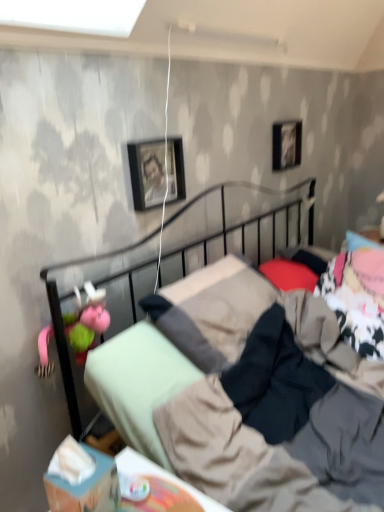
You are a GUI agent. You are given a task and a screenshot of the screen. Output one action in this format:
    pyautogui.click(x=<x>, y=<y>)
    Task: Click on the black glossy picture frame at upper right, the 1th picture frame from the top
    The height and width of the screenshot is (512, 384).
    Given the screenshot: What is the action you would take?
    pyautogui.click(x=286, y=145)

The image size is (384, 512). Describe the element at coordinates (86, 320) in the screenshot. I see `pink fabric doll at left` at that location.

Locate an element on the screen. This screenshot has width=384, height=512. blue cardboard box at lower left is located at coordinates (85, 487).

Describe the element at coordinates (289, 274) in the screenshot. This screenshot has height=512, width=384. I see `red matte pillow at center, marked as the first pillow in a front-to-back arrangement` at that location.

Image resolution: width=384 pixels, height=512 pixels. What are the coordinates of `black matte picture frame at upper center, acting as the 1th picture frame starting from the front` in the screenshot? It's located at (147, 173).

Find the location of a particular element. This screenshot has width=384, height=512. pillow that is the 2nd one when counting backward from the metallic black bed at center is located at coordinates (360, 242).

Which object is wider, pink fabric pillow at upper right, the 1th pillow when ordered from right to left, or metallic black bed at center?

metallic black bed at center is wider.

Is pink fabric pillow at upper right, which ranks as the second pillow in left-to-right order, looking in the opposite direction of metallic black bed at center?

Answer: No, pink fabric pillow at upper right, which ranks as the second pillow in left-to-right order,'s orientation is not away from metallic black bed at center.

Is pink fabric pillow at upper right, which is the first pillow in top-to-bottom order, situated inside metallic black bed at center or outside?

The correct answer is: outside.

Can you see black glossy picture frame at upper right, which is the 2th picture frame in bottom-to-top order, touching red matte pillow at center, the 2th pillow in the right-to-left sequence?

No.

Is black glossy picture frame at upper right, which appears as the first picture frame when viewed from the right, further to camera compared to red matte pillow at center, which is the second pillow in back-to-front order?

Yes, it is behind red matte pillow at center, which is the second pillow in back-to-front order.

From the image's perspective, is black glossy picture frame at upper right, which is the 2th picture frame in bottom-to-top order, above or below red matte pillow at center, acting as the 1th pillow starting from the left?

From the image's perspective, black glossy picture frame at upper right, which is the 2th picture frame in bottom-to-top order, appears above red matte pillow at center, acting as the 1th pillow starting from the left.

How many degrees apart are the facing directions of blue cardboard box at lower left and metallic black bed at center?

The facing directions of blue cardboard box at lower left and metallic black bed at center are 7.95 degrees apart.

Are blue cardboard box at lower left and metallic black bed at center located far from each other?

blue cardboard box at lower left is actually quite close to metallic black bed at center.

From a real-world perspective, which is physically above, blue cardboard box at lower left or metallic black bed at center?

In real-world perspective, blue cardboard box at lower left is above.

Who is shorter, blue cardboard box at lower left or metallic black bed at center?

blue cardboard box at lower left.

Is black glossy picture frame at upper right, placed as the first picture frame when sorted from back to front, located outside pink fabric pillow at upper right, the 1th pillow when ordered from right to left?

That's correct, black glossy picture frame at upper right, placed as the first picture frame when sorted from back to front, is outside of pink fabric pillow at upper right, the 1th pillow when ordered from right to left.

From a real-world perspective, between black glossy picture frame at upper right, placed as the first picture frame when sorted from back to front, and pink fabric pillow at upper right, the 1th pillow from the back, who is vertically higher?

From a 3D spatial view, black glossy picture frame at upper right, placed as the first picture frame when sorted from back to front, is above.

In terms of width, does black glossy picture frame at upper right, the 1th picture frame from the top, look wider or thinner when compared to pink fabric pillow at upper right, which appears as the 2th pillow when ordered from the bottom?

In the image, black glossy picture frame at upper right, the 1th picture frame from the top, appears to be more narrow than pink fabric pillow at upper right, which appears as the 2th pillow when ordered from the bottom.

Considering the relative sizes of black glossy picture frame at upper right, which is the 2th picture frame in bottom-to-top order, and pink fabric pillow at upper right, the 1th pillow from the back, in the image provided, is black glossy picture frame at upper right, which is the 2th picture frame in bottom-to-top order, shorter than pink fabric pillow at upper right, the 1th pillow from the back,?

Incorrect, the height of black glossy picture frame at upper right, which is the 2th picture frame in bottom-to-top order, does not fall short of that of pink fabric pillow at upper right, the 1th pillow from the back.

From the image's perspective, which is below, pink fabric doll at left or pink fabric pillow at upper right, the 1th pillow when ordered from right to left?

pink fabric doll at left appears lower in the image.

Considering the positions of points (78, 313) and (347, 236), is point (78, 313) closer to camera compared to point (347, 236)?

Yes, point (78, 313) is closer to viewer.

Does pink fabric doll at left contain pink fabric pillow at upper right, the 1th pillow from the back?

No, pink fabric pillow at upper right, the 1th pillow from the back, is not a part of pink fabric doll at left.

Considering the sizes of objects metallic black bed at center and black glossy picture frame at upper right, arranged as the second picture frame when viewed from the front, in the image provided, who is bigger, metallic black bed at center or black glossy picture frame at upper right, arranged as the second picture frame when viewed from the front,?

metallic black bed at center is bigger.

Is metallic black bed at center taller or shorter than black glossy picture frame at upper right, arranged as the second picture frame when viewed from the front?

metallic black bed at center is taller than black glossy picture frame at upper right, arranged as the second picture frame when viewed from the front.

Considering the positions of objects metallic black bed at center and black glossy picture frame at upper right, which appears as the first picture frame when viewed from the right, in the image provided, who is more to the left, metallic black bed at center or black glossy picture frame at upper right, which appears as the first picture frame when viewed from the right,?

metallic black bed at center.

From the image's perspective, which object appears higher, black matte picture frame at upper center, which is the second picture frame in right-to-left order, or metallic black bed at center?

black matte picture frame at upper center, which is the second picture frame in right-to-left order, is shown above in the image.

From a real-world perspective, relative to metallic black bed at center, is black matte picture frame at upper center, acting as the 1th picture frame starting from the front, vertically above or below?

In terms of real-world spatial position, black matte picture frame at upper center, acting as the 1th picture frame starting from the front, is above metallic black bed at center.

Is metallic black bed at center at the back of black matte picture frame at upper center, which is the second picture frame in right-to-left order?

No, black matte picture frame at upper center, which is the second picture frame in right-to-left order, is not facing the opposite direction of metallic black bed at center.

Image resolution: width=384 pixels, height=512 pixels. Find the location of `bed lying below the pink fabric pillow at upper right, the 1th pillow when ordered from right to left (from the image's perspective)`. bed lying below the pink fabric pillow at upper right, the 1th pillow when ordered from right to left (from the image's perspective) is located at coordinates (232, 403).

There is a red matte pillow at center, the 2th pillow in the right-to-left sequence. Where is `the 2nd picture frame above it (from a real-world perspective)`? the 2nd picture frame above it (from a real-world perspective) is located at coordinates (286, 145).

From the image, which object appears to be nearer to pink fabric pillow at upper right, which appears as the 2th pillow when ordered from the bottom, black matte picture frame at upper center, acting as the 1th picture frame starting from the front, or metallic black bed at center?

Among the two, black matte picture frame at upper center, acting as the 1th picture frame starting from the front, is located nearer to pink fabric pillow at upper right, which appears as the 2th pillow when ordered from the bottom.

Based on their spatial positions, is metallic black bed at center or blue cardboard box at lower left further from black matte picture frame at upper center, which is the second picture frame in right-to-left order?

Among the two, blue cardboard box at lower left is located further to black matte picture frame at upper center, which is the second picture frame in right-to-left order.

Looking at the image, which one is located further to pink fabric doll at left, blue cardboard box at lower left or black matte picture frame at upper center, acting as the 1th picture frame starting from the front?

blue cardboard box at lower left is further to pink fabric doll at left.

Looking at the image, which one is located further to pink fabric doll at left, black glossy picture frame at upper right, the 1th picture frame from the top, or red matte pillow at center, which is the second pillow in back-to-front order?

black glossy picture frame at upper right, the 1th picture frame from the top.

From the image, which object appears to be farther from blue cardboard box at lower left, red matte pillow at center, the 2th pillow in the right-to-left sequence, or metallic black bed at center?

Among the two, red matte pillow at center, the 2th pillow in the right-to-left sequence, is located further to blue cardboard box at lower left.

In the scene shown: Looking at the image, which one is located closer to pink fabric pillow at upper right, which is the first pillow in top-to-bottom order, black glossy picture frame at upper right, which is the 2th picture frame in bottom-to-top order, or black matte picture frame at upper center, acting as the 1th picture frame starting from the front?

Based on the image, black glossy picture frame at upper right, which is the 2th picture frame in bottom-to-top order, appears to be nearer to pink fabric pillow at upper right, which is the first pillow in top-to-bottom order.

Which object lies nearer to the anchor point pink fabric pillow at upper right, the 1th pillow from the back, black glossy picture frame at upper right, which appears as the first picture frame when viewed from the right, or blue cardboard box at lower left?

The object closer to pink fabric pillow at upper right, the 1th pillow from the back, is black glossy picture frame at upper right, which appears as the first picture frame when viewed from the right.

In the scene shown: Estimate the real-world distances between objects in this image. Which object is closer to red matte pillow at center, the 2th pillow in the right-to-left sequence, pink fabric pillow at upper right, which is the first pillow in top-to-bottom order, or black matte picture frame at upper center, which is the first picture frame from left to right?

Based on the image, pink fabric pillow at upper right, which is the first pillow in top-to-bottom order, appears to be nearer to red matte pillow at center, the 2th pillow in the right-to-left sequence.

Where is `box located between pink fabric doll at left and pink fabric pillow at upper right, the 1th pillow from the back, in the left-right direction`? This screenshot has height=512, width=384. box located between pink fabric doll at left and pink fabric pillow at upper right, the 1th pillow from the back, in the left-right direction is located at coordinates (85, 487).

Where is `pillow between blue cardboard box at lower left and pink fabric pillow at upper right, which is the first pillow in top-to-bottom order, from front to back`? pillow between blue cardboard box at lower left and pink fabric pillow at upper right, which is the first pillow in top-to-bottom order, from front to back is located at coordinates (289, 274).

Locate an element on the screen. The width and height of the screenshot is (384, 512). doll between metallic black bed at center and red matte pillow at center, marked as the second pillow in a top-to-bottom arrangement, along the z-axis is located at coordinates (86, 320).

This screenshot has width=384, height=512. Identify the location of pillow between pink fabric doll at left and black glossy picture frame at upper right, arranged as the second picture frame when viewed from the front, along the z-axis. (289, 274).